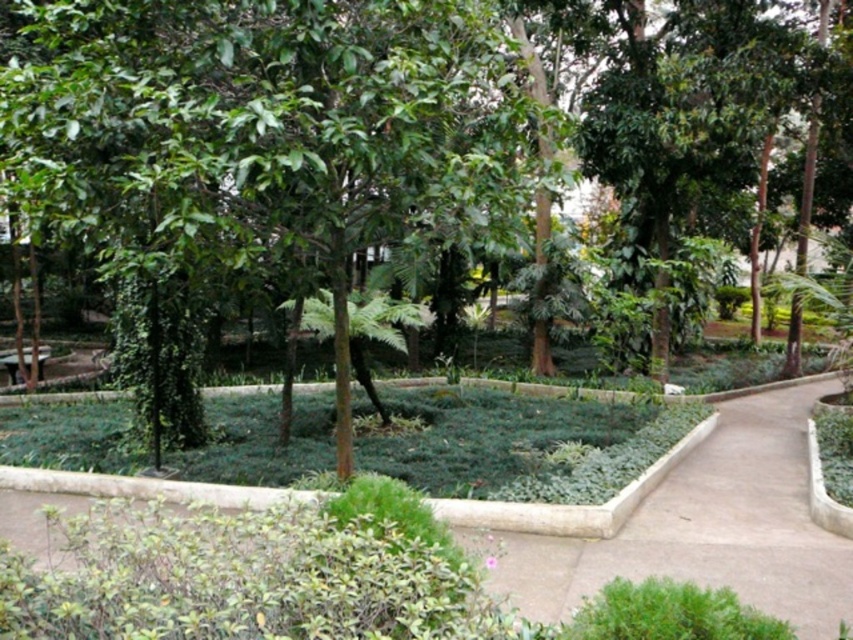
You are a gardener planning to place a new flower bed along the brown concrete path at center. Considering the width of the path, would the wooden park bench at lower left be a better location for the flower bed?

The brown concrete path at center has a lesser width compared to the wooden park bench at lower left, so the wooden park bench at lower left is wider and would be a better location for the flower bed.

You are a gardener who needs to place a new decorative statue that is 1.5 meters wide. You have two options for placement in the garden scene described. The first option is along the brown concrete path at center, and the second option is near the wooden park bench at lower left. Based on the size of these areas, which location would be more suitable for placing the statue without overcrowding the space?

The wooden park bench at lower left has a larger size compared to the brown concrete path at center. Therefore, placing the statue near the wooden park bench at lower left would be more suitable as it provides enough space for the 1.5 meter wide statue without overcrowding the area.